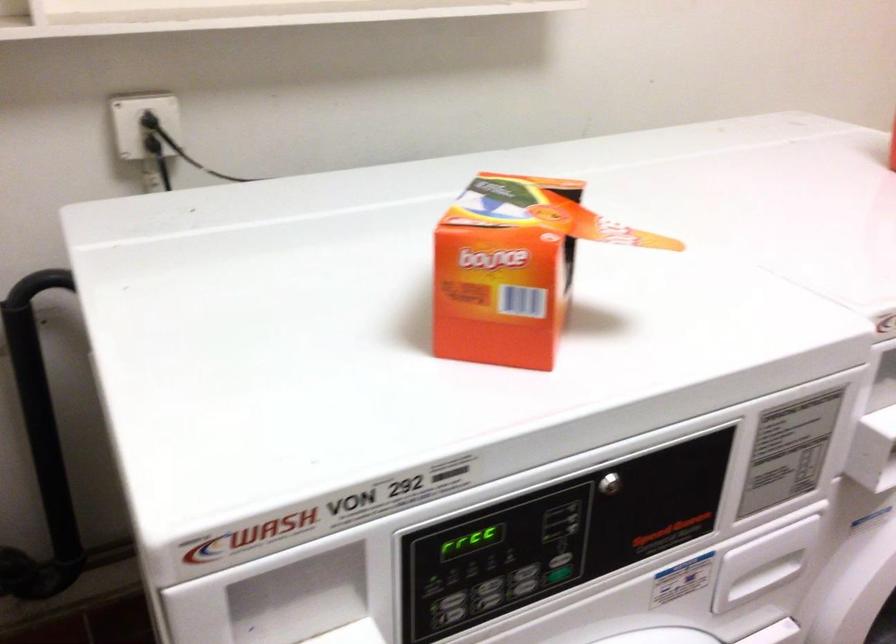
The width and height of the screenshot is (896, 644). In order to click on black power plug in this screenshot , I will do `click(150, 122)`.